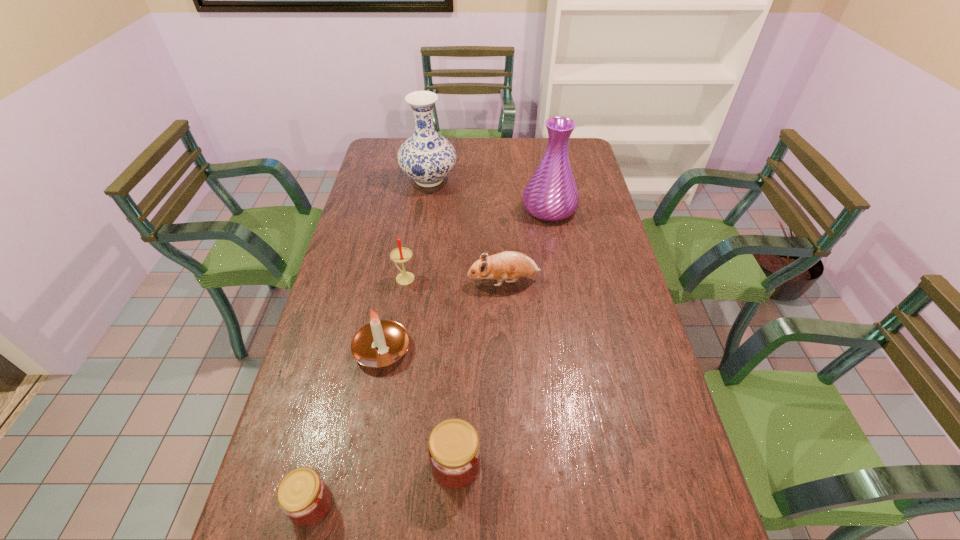
The image size is (960, 540). Find the location of `free space between the hamster and the farther candle`. free space between the hamster and the farther candle is located at coordinates (454, 280).

At what (x,y) coordinates should I click in order to perform the action: click on free space between the right vase and the farther candle. Please return your answer as a coordinate pair (x, y). The height and width of the screenshot is (540, 960). Looking at the image, I should click on (477, 244).

The width and height of the screenshot is (960, 540). I want to click on free space between the shorter jam and the right vase, so 430,357.

Find the location of a particular element. vacant point located between the farther candle and the shorter jam is located at coordinates (358, 392).

The width and height of the screenshot is (960, 540). Identify the location of free area in between the hamster and the right jam. (480, 373).

The image size is (960, 540). Find the location of `free space between the left vase and the farther candle`. free space between the left vase and the farther candle is located at coordinates (417, 229).

Identify the location of empty location between the taller jam and the shortest object. tap(384, 485).

The width and height of the screenshot is (960, 540). What are the coordinates of `vacant point located between the right vase and the right jam` in the screenshot? It's located at (502, 336).

Find the location of a particular element. vacant point located between the hamster and the farther candle is located at coordinates [454, 280].

Identify which object is the third nearest to the hamster. Please provide its 2D coordinates. Your answer should be formatted as a tuple, i.e. [(x, y)], where the tuple contains the x and y coordinates of a point satisfying the conditions above.

[(551, 194)]